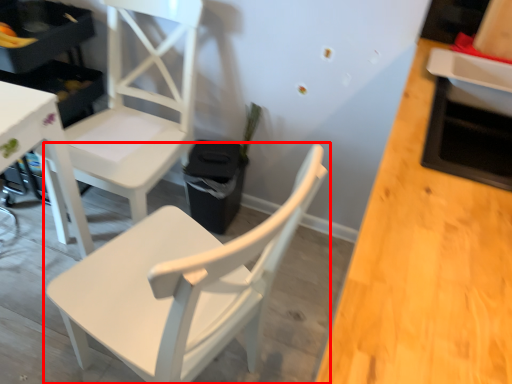
Question: From the image's perspective, what is the correct spatial relationship of chair (annotated by the red box) in relation to chair?

Choices:
 (A) below
 (B) above

Answer: (A)